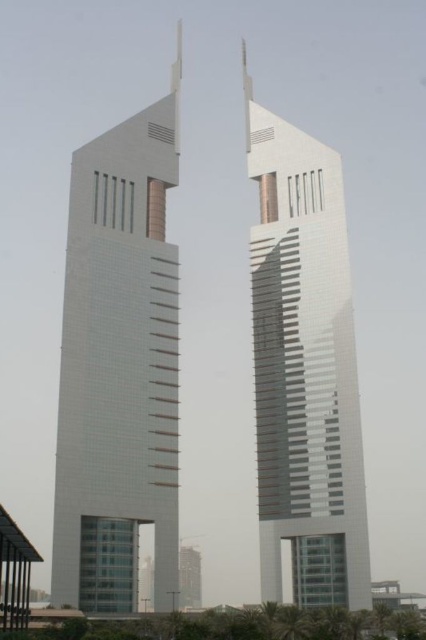
Question: Which point is farther to the camera?

Choices:
 (A) white glass tower at center
 (B) shiny glass tower at center

Answer: (B)

Question: Does white glass tower at center have a larger size compared to shiny glass tower at center?

Choices:
 (A) yes
 (B) no

Answer: (A)

Question: Among these points, which one is nearest to the camera?

Choices:
 (A) (282, 230)
 (B) (124, 193)

Answer: (B)

Question: In this image, where is white glass tower at center located relative to shiny glass tower at center?

Choices:
 (A) left
 (B) right

Answer: (A)

Question: Does white glass tower at center appear on the left side of shiny glass tower at center?

Choices:
 (A) no
 (B) yes

Answer: (B)